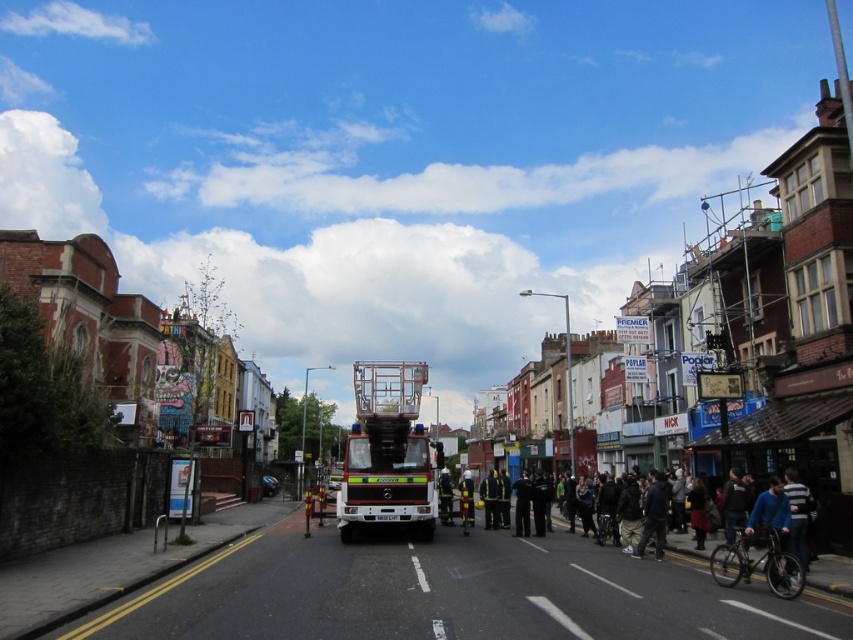
Between point (735, 552) and point (445, 472), which one is positioned in front?

Point (735, 552) is more forward.

Does dark blue jeans at center have a lesser height compared to reflective silver helmet at center?

In fact, dark blue jeans at center may be taller than reflective silver helmet at center.

In order to click on dark blue jeans at center in this screenshot , I will do `click(759, 554)`.

Locate an element on the screen. The width and height of the screenshot is (853, 640). dark blue jeans at center is located at coordinates (759, 554).

Can you confirm if reflective yellow uniform at center is positioned above reflective silver helmet at center?

Actually, reflective yellow uniform at center is below reflective silver helmet at center.

Is point (483, 492) behind point (438, 499)?

No.

This screenshot has height=640, width=853. I want to click on reflective yellow uniform at center, so click(490, 499).

Can you confirm if reflective yellow uniform at center is positioned to the left of reflective yellow jacket at center?

No, reflective yellow uniform at center is not to the left of reflective yellow jacket at center.

What do you see at coordinates (490, 499) in the screenshot?
I see `reflective yellow uniform at center` at bounding box center [490, 499].

What do you see at coordinates (490, 499) in the screenshot? I see `reflective yellow uniform at center` at bounding box center [490, 499].

Locate an element on the screen. reflective yellow uniform at center is located at coordinates (490, 499).